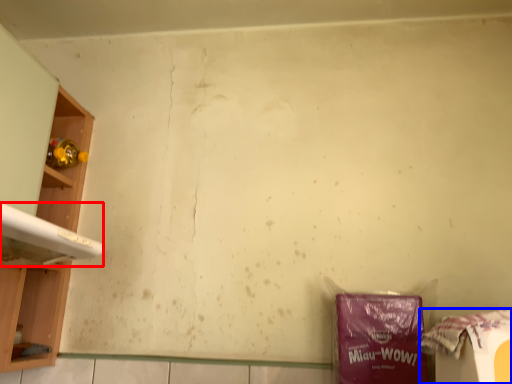
Question: Which object is further to the camera taking this photo, washing (highlighted by a red box) or waste (highlighted by a blue box)?

Choices:
 (A) washing
 (B) waste

Answer: (A)